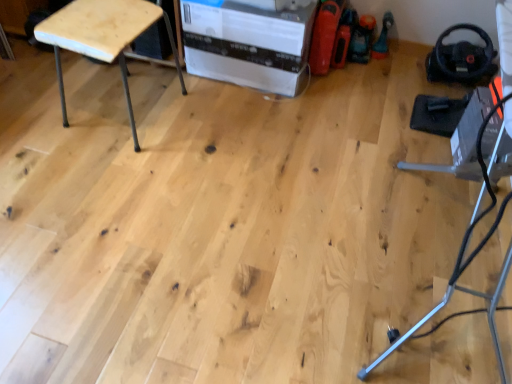
Locate an element on the screen. The width and height of the screenshot is (512, 384). vacant space to the right of natural wood stool at upper left is located at coordinates pyautogui.click(x=200, y=128).